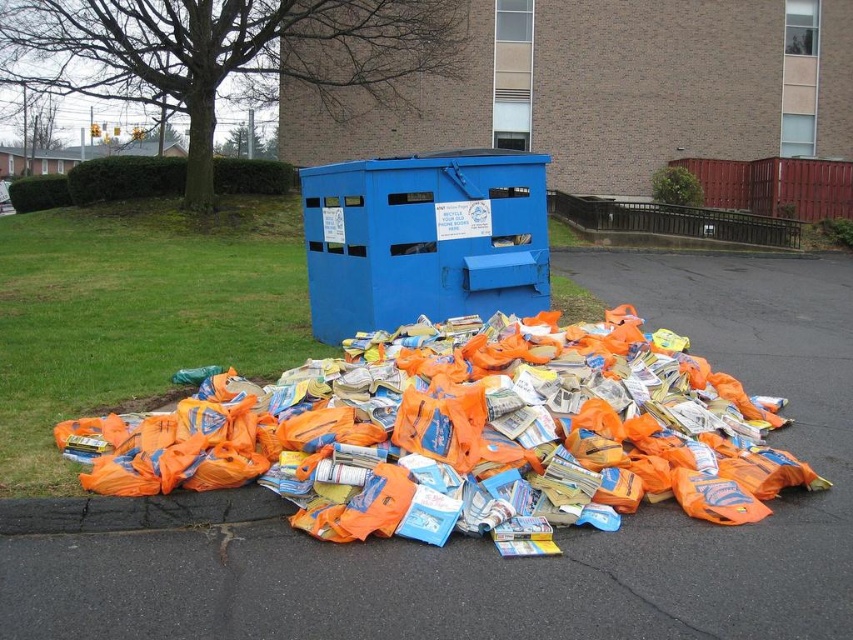
You are a recycling worker who needs to move the orange plastic bags at center and the blue metallic dumpster at center to a different location. Which object should you move first if you want to clear the area more efficiently?

The orange plastic bags at center is much taller than the blue metallic dumpster at center, so you should move the orange plastic bags at center first to make space for moving the dumpster more easily.

You are standing in front of the orange plastic bags at center and the blue metallic dumpster at center. Which object is nearer to you?

The orange plastic bags at center are closer to you than the blue metallic dumpster at center.

You are a recycling worker who needs to move the orange plastic bags at center and the blue metallic dumpster at center to a different location. If you have a truck with a 1.5 meter wide loading area, can both items fit side by side without overlapping?

The orange plastic bags at center has a larger size compared to blue metallic dumpster at center. Since the orange plastic bags at center are larger, they might occupy more space. However, without specific width measurements, it is uncertain if both can fit side by side in the 1.5 meter wide loading area. Additional information about their exact dimensions would be needed to determine this.